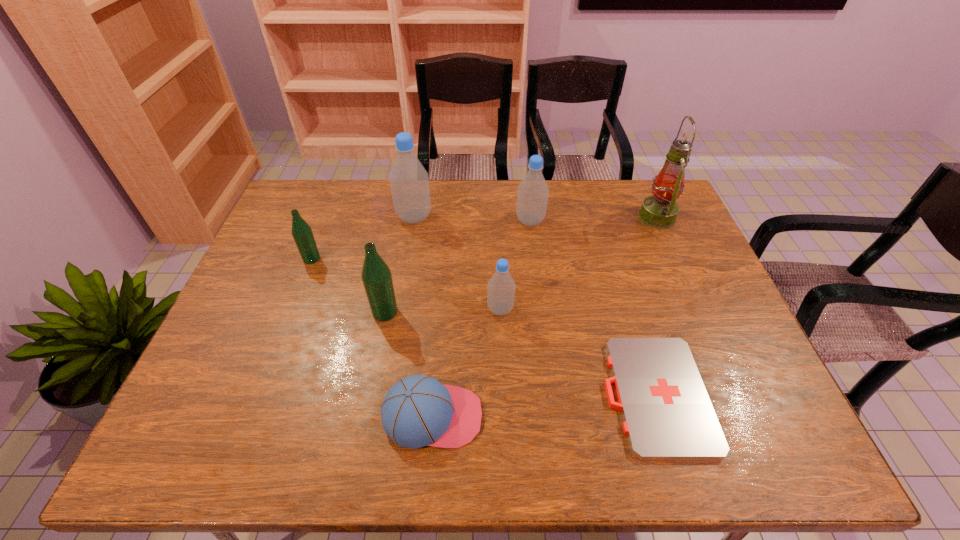
The width and height of the screenshot is (960, 540). What are the coordinates of `the farther green bottle` in the screenshot? It's located at (302, 233).

What are the coordinates of `the smaller green bottle` in the screenshot? It's located at (302, 233).

Where is `the seventh tallest object`? Image resolution: width=960 pixels, height=540 pixels. the seventh tallest object is located at coordinates (418, 411).

The width and height of the screenshot is (960, 540). In order to click on baseball cap in this screenshot , I will do tap(418, 411).

At what (x,y) coordinates should I click in order to perform the action: click on the shortest object. Please return your answer as a coordinate pair (x, y). The width and height of the screenshot is (960, 540). Looking at the image, I should click on (667, 413).

At what (x,y) coordinates should I click in order to perform the action: click on the second object from right to left. Please return your answer as a coordinate pair (x, y). The height and width of the screenshot is (540, 960). Looking at the image, I should click on (667, 413).

Find the location of a particular element. This screenshot has width=960, height=540. free location located 0.250m on the left of the oil lamp is located at coordinates (564, 218).

Image resolution: width=960 pixels, height=540 pixels. Find the location of `free space located on the front of the leftmost gray bottle`. free space located on the front of the leftmost gray bottle is located at coordinates (409, 248).

This screenshot has width=960, height=540. In order to click on vacant space located 0.210m on the left of the rightmost bottle in this screenshot , I will do `click(452, 221)`.

Image resolution: width=960 pixels, height=540 pixels. Identify the location of free space located on the right of the bigger green bottle. point(444,312).